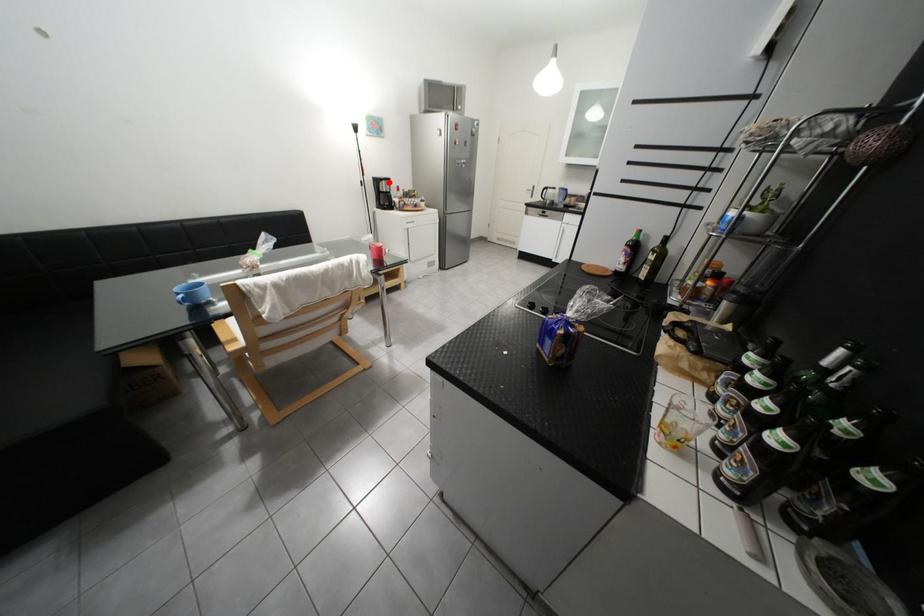
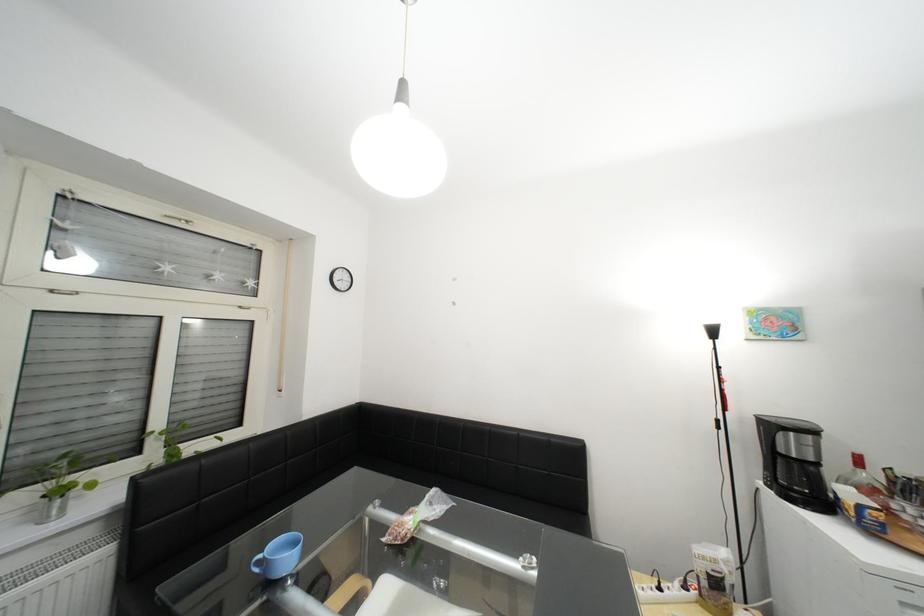
Question: I am providing you with two images of the same scene from different viewpoints. In image1, a red point is highlighted. Considering the same 3D point in image2, which of the following is correct?

Choices:
 (A) It is closer
 (B) It is farther

Answer: (B)